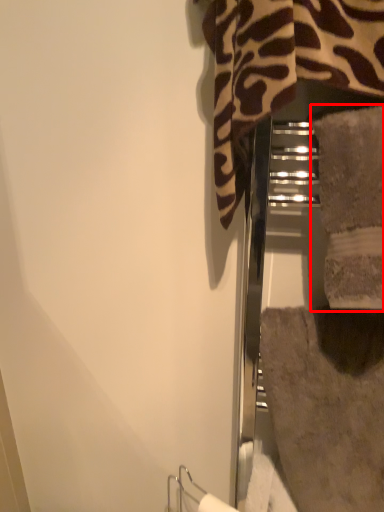
Question: From the image, what is the correct spatial relationship of towel (annotated by the red box) in relation to bath towel?

Choices:
 (A) right
 (B) left

Answer: (B)